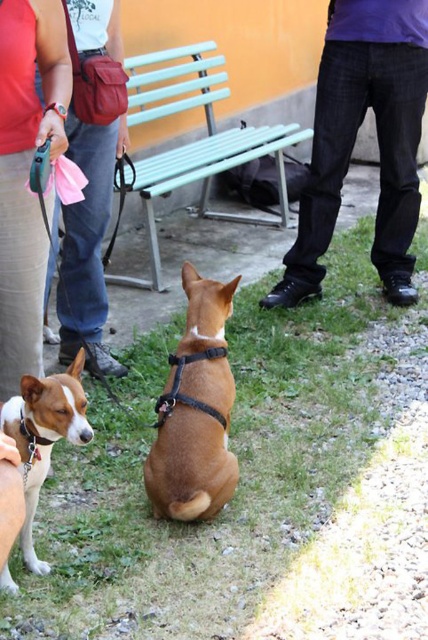
Question: Which of the following is the farthest from the observer?

Choices:
 (A) (228, 625)
 (B) (39, 456)
 (C) (374, 100)
 (D) (35, 300)

Answer: (C)

Question: Is brown grass at center positioned before light blue plastic bench at center?

Choices:
 (A) yes
 (B) no

Answer: (A)

Question: Which point is farther to the camera?

Choices:
 (A) (344, 157)
 (B) (234, 134)

Answer: (B)

Question: Is matte pink shirt at upper left further to the viewer compared to brown matte harness at center?

Choices:
 (A) no
 (B) yes

Answer: (A)

Question: Which object is closer to the camera taking this photo?

Choices:
 (A) brushed leather bag at left
 (B) matte pink shirt at upper left
 (C) brown matte harness at center
 (D) brown grass at center

Answer: (B)

Question: Does matte pink shirt at upper left come in front of white leather collar at lower left?

Choices:
 (A) no
 (B) yes

Answer: (A)